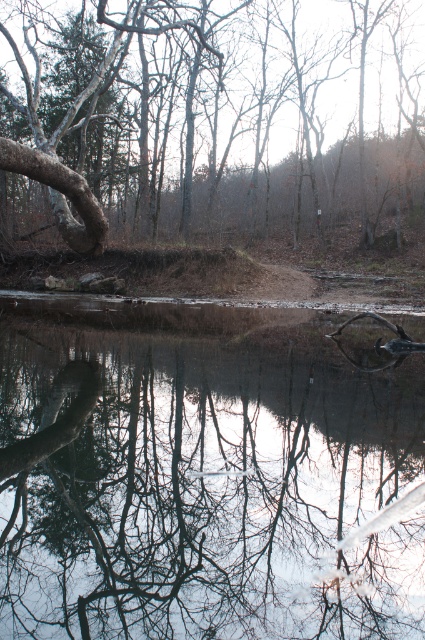
Is transparent glass lake at center positioned behind smooth bark tree at center?

That is False.

Which is in front, point (265, 625) or point (283, 81)?

Point (265, 625) is in front.

Describe the element at coordinates (206, 474) in the screenshot. I see `transparent glass lake at center` at that location.

You are a GUI agent. You are given a task and a screenshot of the screen. Output one action in this format:
    pyautogui.click(x=<x>, y=<y>)
    Task: Click on the transparent glass lake at center
    This screenshot has width=425, height=640.
    Given the screenshot: What is the action you would take?
    pyautogui.click(x=206, y=474)